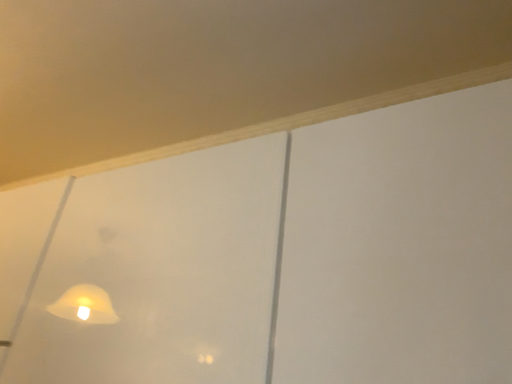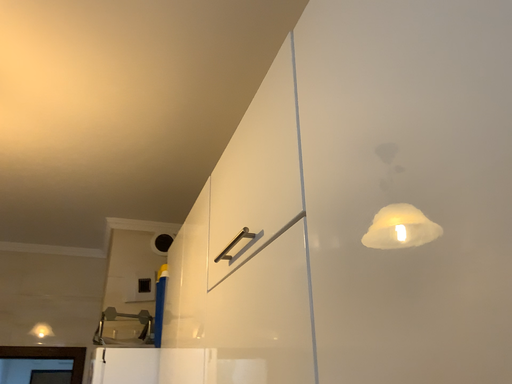
Question: Which way did the camera rotate in the video?

Choices:
 (A) rotated left
 (B) rotated right

Answer: (A)